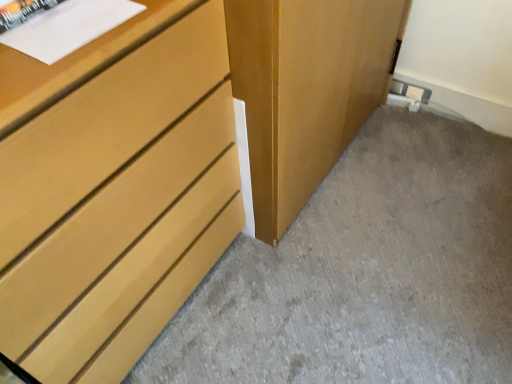
Question: Should I look upward or downward to see matte wood chest of drawers at left?

Choices:
 (A) down
 (B) up

Answer: (A)

Question: Is matte wood chest of drawers at left far from matte wood dresser at lower left?

Choices:
 (A) no
 (B) yes

Answer: (A)

Question: Is matte wood chest of drawers at left next to matte wood dresser at lower left and touching it?

Choices:
 (A) no
 (B) yes

Answer: (A)

Question: Is matte wood chest of drawers at left positioned with its back to matte wood dresser at lower left?

Choices:
 (A) yes
 (B) no

Answer: (B)

Question: Is matte wood dresser at lower left inside matte wood chest of drawers at left?

Choices:
 (A) yes
 (B) no

Answer: (B)

Question: From the image's perspective, is matte wood chest of drawers at left below matte wood dresser at lower left?

Choices:
 (A) no
 (B) yes

Answer: (A)

Question: Can you confirm if matte wood chest of drawers at left is bigger than matte wood dresser at lower left?

Choices:
 (A) no
 (B) yes

Answer: (B)

Question: From a real-world perspective, is matte wood dresser at lower left on top of matte wood chest of drawers at left?

Choices:
 (A) no
 (B) yes

Answer: (A)

Question: From the image's perspective, is matte wood dresser at lower left under matte wood chest of drawers at left?

Choices:
 (A) no
 (B) yes

Answer: (B)

Question: Is matte wood dresser at lower left shorter than matte wood chest of drawers at left?

Choices:
 (A) yes
 (B) no

Answer: (A)

Question: Is matte wood dresser at lower left taller than matte wood chest of drawers at left?

Choices:
 (A) no
 (B) yes

Answer: (A)

Question: Can you confirm if matte wood dresser at lower left is thinner than matte wood chest of drawers at left?

Choices:
 (A) no
 (B) yes

Answer: (A)

Question: Does matte wood dresser at lower left appear on the right side of matte wood chest of drawers at left?

Choices:
 (A) yes
 (B) no

Answer: (A)

Question: Is matte wood dresser at lower left wider or thinner than matte wood chest of drawers at left?

Choices:
 (A) wide
 (B) thin

Answer: (A)